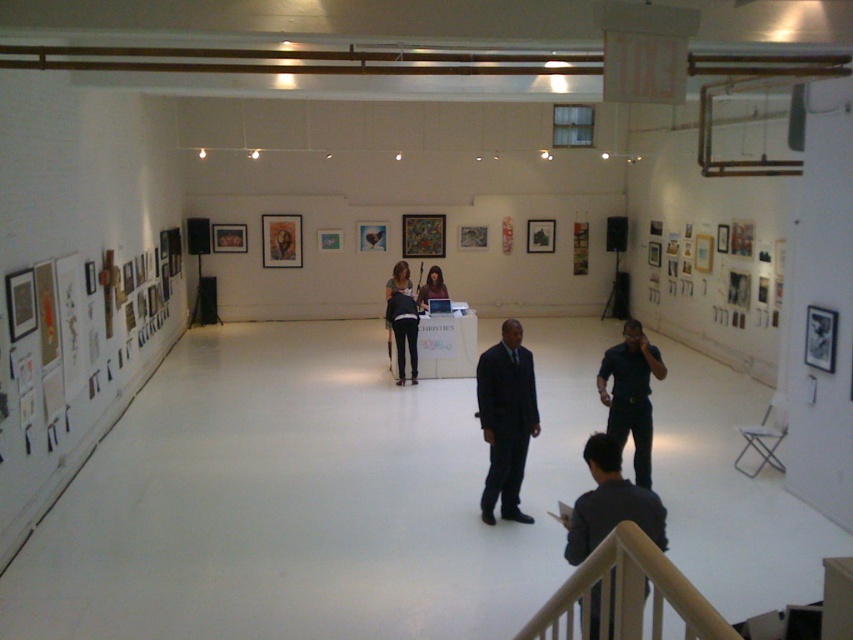
Question: Considering the real-world distances, which object is closest to the dark blue suit at center?

Choices:
 (A) dark blue shirt at right
 (B) matte black jacket at center
 (C) dark blue shirt at lower center
 (D) matte black laptop at center

Answer: (A)

Question: Can you confirm if dark blue shirt at lower center is positioned below matte black laptop at center?

Choices:
 (A) no
 (B) yes

Answer: (B)

Question: Does dark blue suit at center come behind matte black jacket at center?

Choices:
 (A) no
 (B) yes

Answer: (A)

Question: Is the position of dark blue shirt at lower center more distant than that of matte black laptop at center?

Choices:
 (A) yes
 (B) no

Answer: (B)

Question: Which point is farther to the camera?

Choices:
 (A) matte black jacket at center
 (B) dark blue suit at center

Answer: (A)

Question: Which object is the farthest from the dark blue shirt at lower center?

Choices:
 (A) matte black jacket at center
 (B) dark blue shirt at right
 (C) dark blue suit at center

Answer: (A)